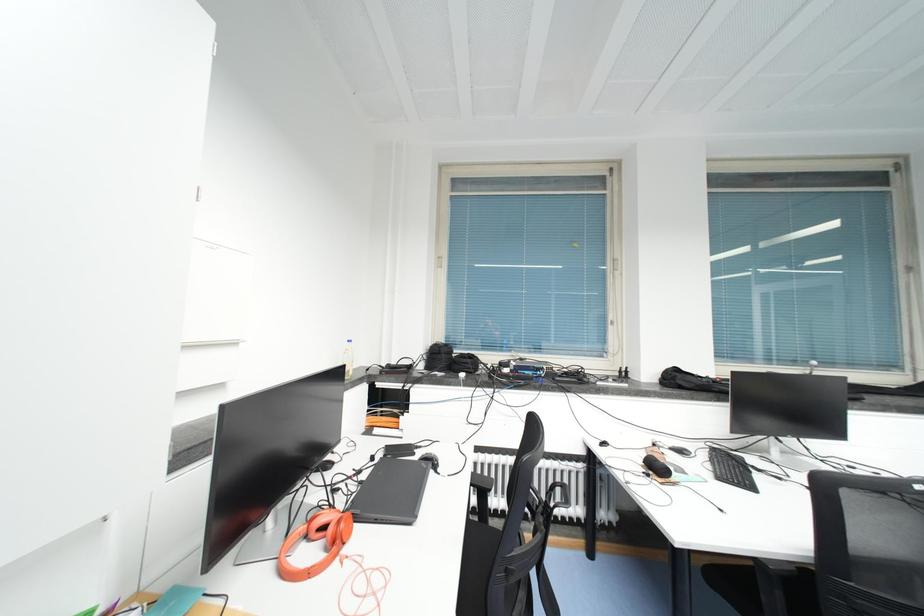
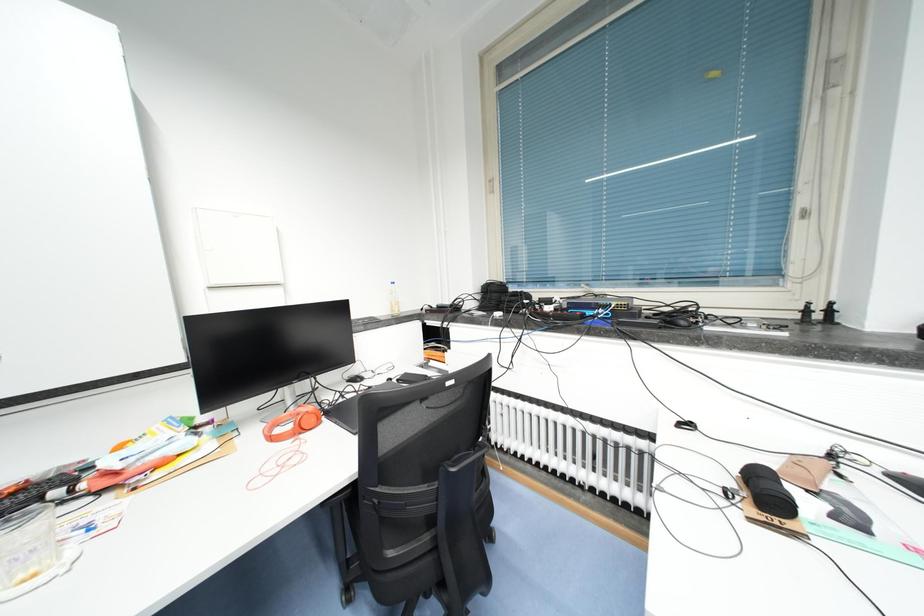
Question: The first image is from the beginning of the video and the second image is from the end. How did the camera likely rotate when shooting the video?

Choices:
 (A) Left
 (B) Right
 (C) Up
 (D) Down

Answer: (A)